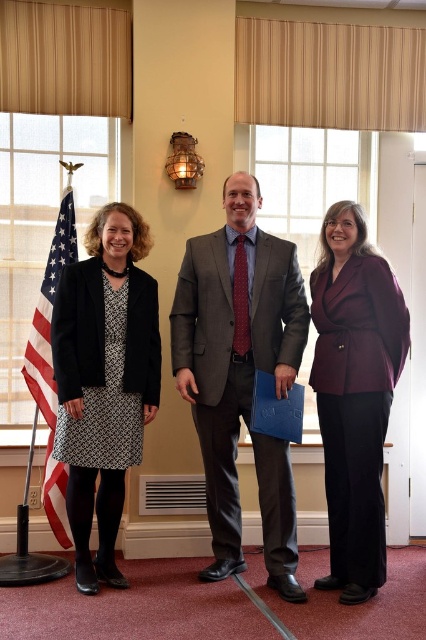
Question: Can you confirm if matte gray suit at center is wider than american flag at left?

Choices:
 (A) no
 (B) yes

Answer: (B)

Question: Estimate the real-world distances between objects in this image. Which object is farther from the blue matte folder at center?

Choices:
 (A) american flag at left
 (B) burgundy wool blazer at center

Answer: (A)

Question: In this image, where is burgundy wool blazer at center located relative to blue matte folder at center?

Choices:
 (A) right
 (B) left

Answer: (A)

Question: Does matte black blazer at left appear under american flag at left?

Choices:
 (A) yes
 (B) no

Answer: (A)

Question: Based on their relative distances, which object is farther from the burgundy wool blazer at center?

Choices:
 (A) matte gray suit at center
 (B) blue matte folder at center
 (C) american flag at left
 (D) matte black blazer at left

Answer: (C)

Question: Among these points, which one is nearest to the camera?

Choices:
 (A) (319, 426)
 (B) (63, 346)
 (C) (294, 328)

Answer: (B)